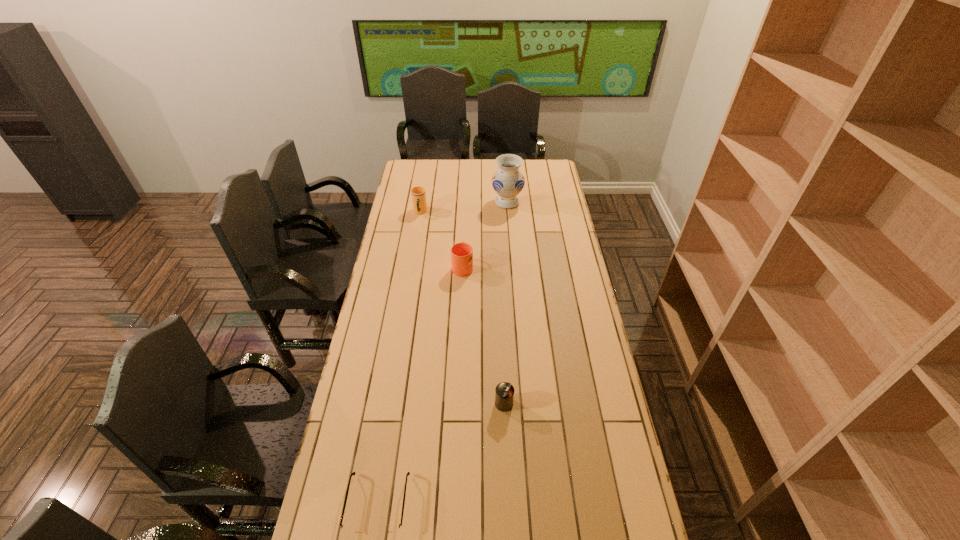
Find the location of a particular element. The width and height of the screenshot is (960, 540). vacant point located between the can and the cup is located at coordinates (462, 308).

Find the location of a particular element. empty space that is in between the third nearest object and the cup is located at coordinates (442, 239).

The height and width of the screenshot is (540, 960). I want to click on free space between the mug and the fourth farthest object, so click(x=483, y=335).

Where is `free spot between the can and the tallest object`? free spot between the can and the tallest object is located at coordinates (506, 303).

You are a GUI agent. You are given a task and a screenshot of the screen. Output one action in this format:
    pyautogui.click(x=<x>, y=<y>)
    Task: Click on the unoccupied position between the tallest object and the cup
    This screenshot has width=960, height=540.
    Given the screenshot: What is the action you would take?
    pyautogui.click(x=464, y=207)

This screenshot has height=540, width=960. In order to click on vacant area that lies between the spectacles and the tallest object in this screenshot , I will do pos(443,353).

Identify the location of free space that is in between the third farthest object and the cup. The height and width of the screenshot is (540, 960). (442, 239).

Find the location of a particular element. free spot between the cup and the can is located at coordinates (462, 308).

You are a GUI agent. You are given a task and a screenshot of the screen. Output one action in this format:
    pyautogui.click(x=<x>, y=<y>)
    Task: Click on the object that is the third closest to the second nearest object
    
    Given the screenshot: What is the action you would take?
    pyautogui.click(x=418, y=194)

The height and width of the screenshot is (540, 960). I want to click on object that ranks as the second closest to the cup, so click(508, 181).